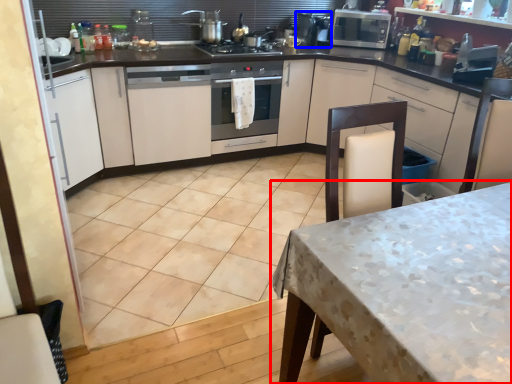
Question: Which point is closer to the camera, table (highlighted by a red box) or appliance (highlighted by a blue box)?

Choices:
 (A) table
 (B) appliance

Answer: (A)